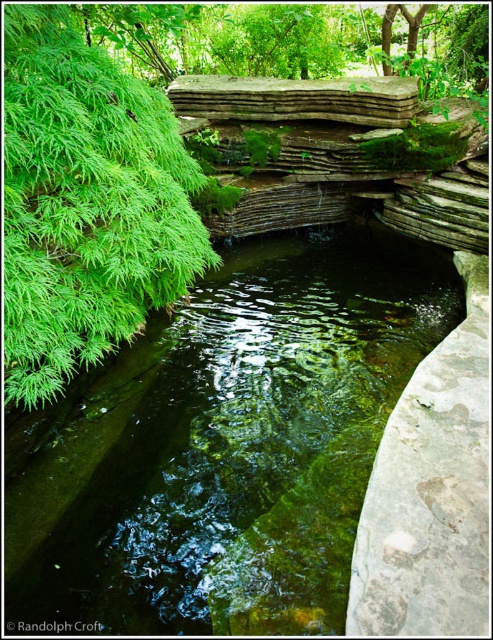
Between point (255, 356) and point (159, 96), which one is positioned behind?

The point (255, 356) is more distant.

Does green mossy stone at center have a lesser height compared to green leafy plant at left?

In fact, green mossy stone at center may be taller than green leafy plant at left.

Locate an element on the screen. This screenshot has height=640, width=493. green mossy stone at center is located at coordinates (230, 445).